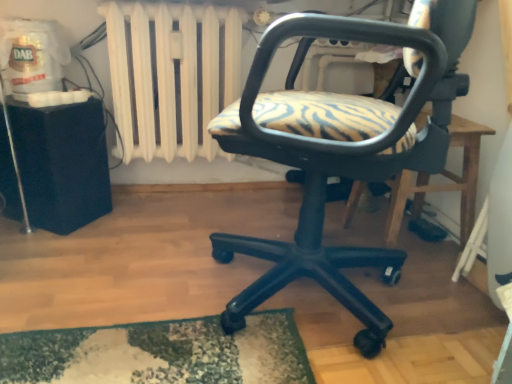
Where is `vacant region to the right of black plastic table at left, marked as the 1th table in a left-to-right arrangement`? The height and width of the screenshot is (384, 512). vacant region to the right of black plastic table at left, marked as the 1th table in a left-to-right arrangement is located at coordinates (125, 227).